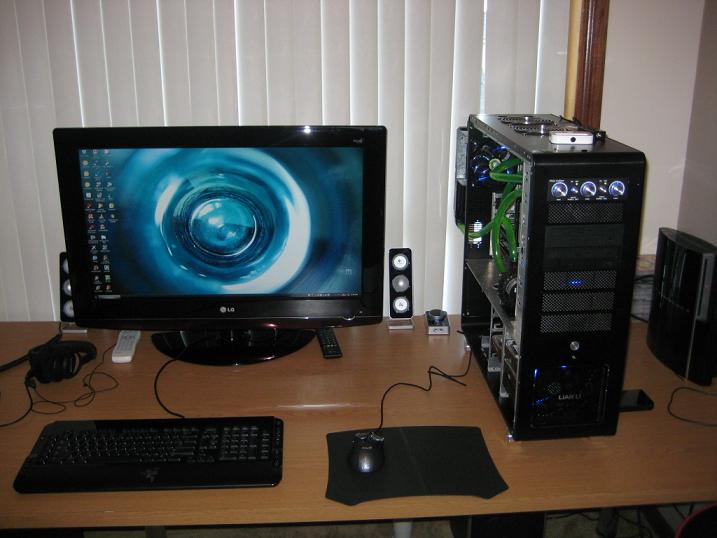
Locate an element on the screen. The width and height of the screenshot is (717, 538). mousepad is located at coordinates (475, 478).